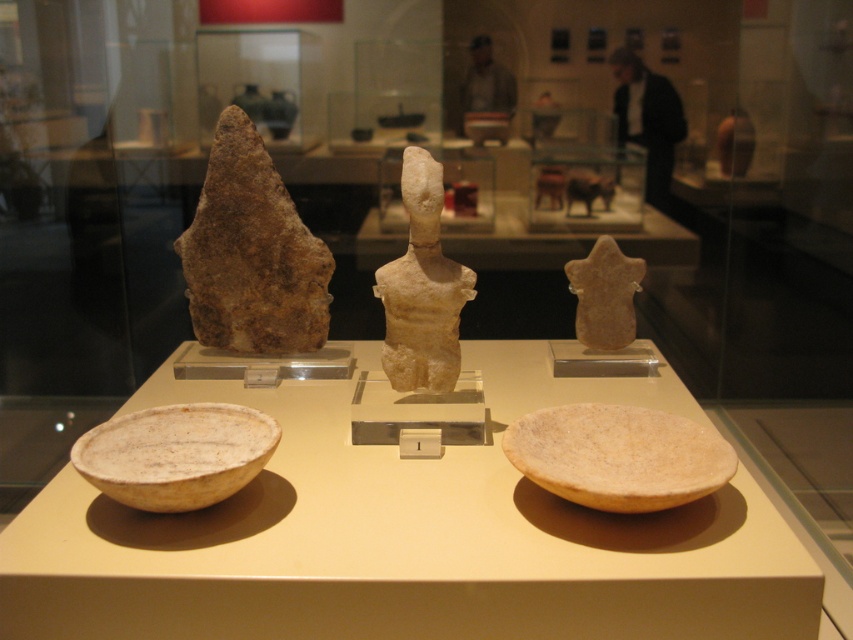
Based on the photo, you are a museum visitor standing in front of the display case. You want to take a photo of the smooth beige stone star at center without the white matte bowl at lower left appearing in the background. Is this possible based on their positions?

The white matte bowl at lower left is closer to the viewer than the smooth beige stone star at center, so if you position yourself so that the bowl is out of the frame or behind the star, you can take a photo of the star without the bowl in the background.

You are a museum curator who wants to place a new artifact between the matte beige bowl at lower center and the white stone figure at center. Which object should you place it closer to if the new artifact is taller than the bowl but shorter than the figure?

You should place the new artifact closer to the white stone figure at center because the matte beige bowl at lower center is shorter than the white stone figure at center, so the new artifact, being taller than the bowl but shorter than the figure, would fit better in proximity to the taller object.

You are a visitor standing in front of the display case. You want to locate the white matte bowl at lower left. According to the display layout, where should you look relative to the other artifacts?

The white matte bowl at lower left is located at the coordinates point (x=177, y=454) in the display case, which places it at the lower left position relative to the other artifacts.